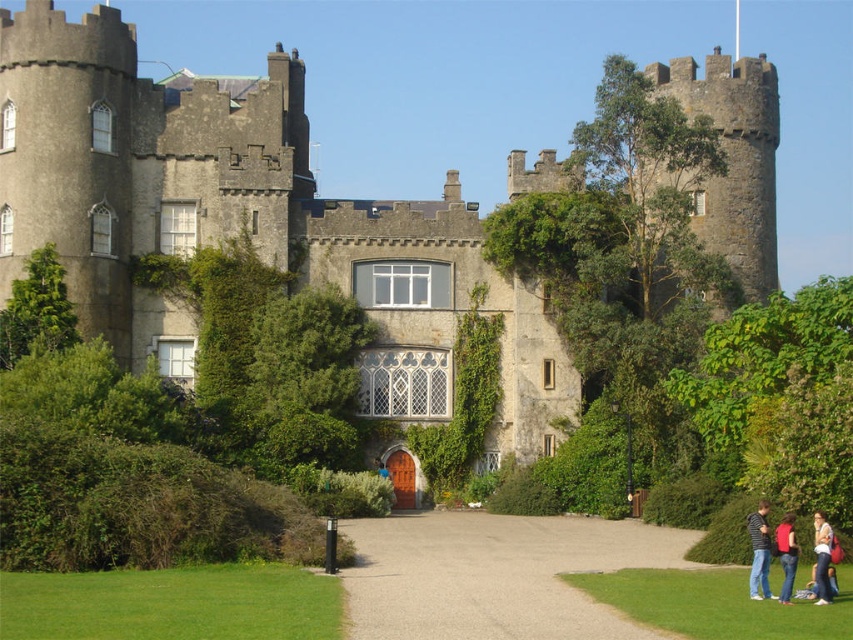
You are a medieval knight standing in front of the castle. You see a denim jacket at lower right and a red fabric jacket at lower right. Which jacket is smaller?

The denim jacket at lower right is smaller than the red fabric jacket at lower right.

You are standing in front of the castle and notice a point marked at coordinates [822,557]. Based on the scene description, where is this point located?

The point is located on the denim jacket at lower right.

You are a visitor approaching the castle and see the smooth gravel path at center and the red fabric jacket at lower right. Which object is closer to you as you approach the castle?

The smooth gravel path at center is closer to you because it is in front of the red fabric jacket at lower right.